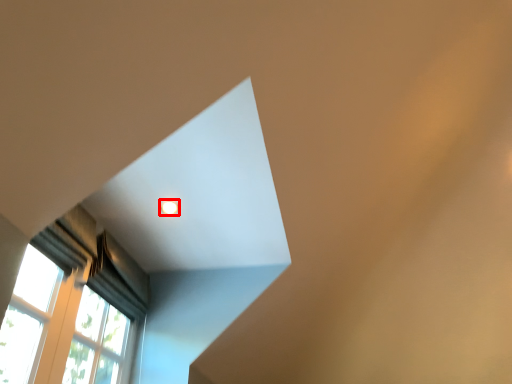
Question: From the image's perspective, what is the correct spatial positioning of lighting (annotated by the red box) in reference to curtain?

Choices:
 (A) below
 (B) above

Answer: (B)